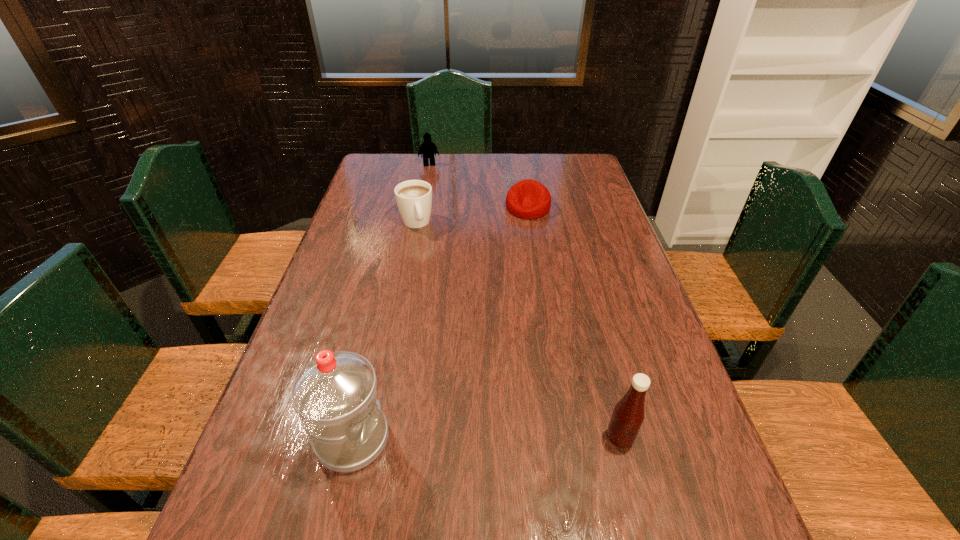
Identify the location of vacant space on the desktop that is between the water bottle and the Tabasco sauce and is positioned on the face of the farthest object. (489, 438).

Identify the location of free space on the desktop that is between the water bottle and the rightmost object and is positioned with the handle on the side of the cappuccino. The image size is (960, 540). (498, 438).

The width and height of the screenshot is (960, 540). I want to click on vacant space on the desktop that is between the water bottle and the rightmost object and is positioned on the seat area of the beanbag, so click(x=503, y=438).